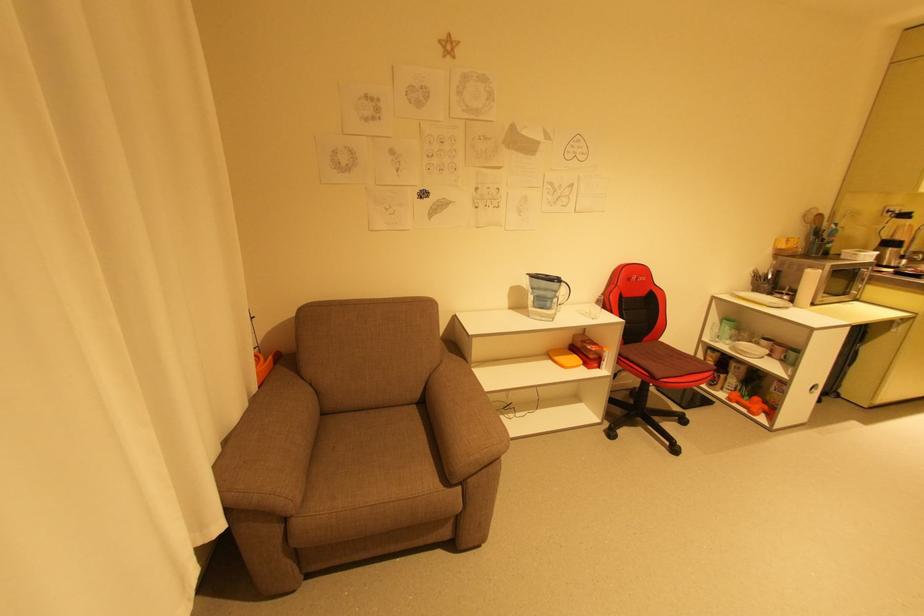
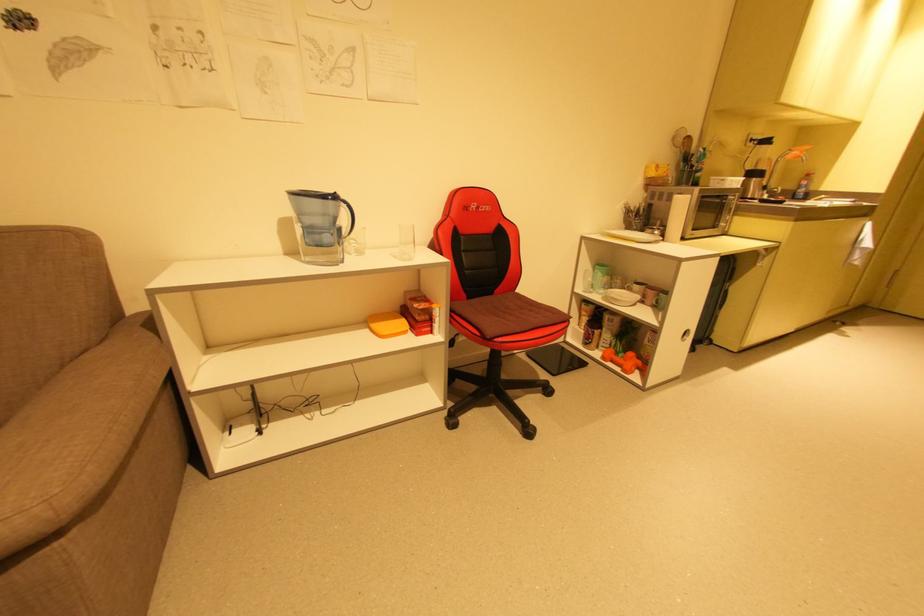
Find the pixel in the second image that matches point (646, 342) in the first image.

(495, 294)